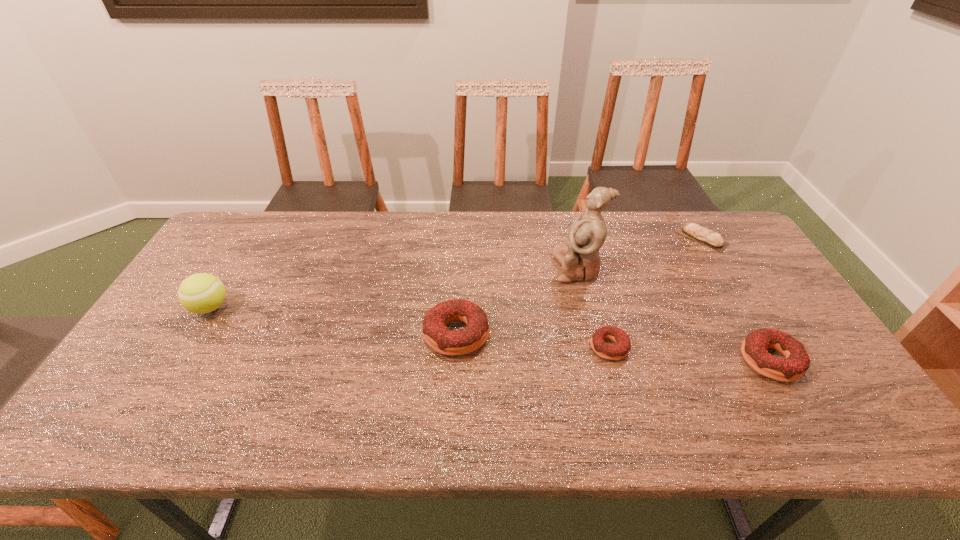
Please point a spot on the left to add another doughnut. Please provide its 2D coordinates. Your answer should be formatted as a tuple, i.e. [(x, y)], where the tuple contains the x and y coordinates of a point satisfying the conditions above.

[(312, 322)]